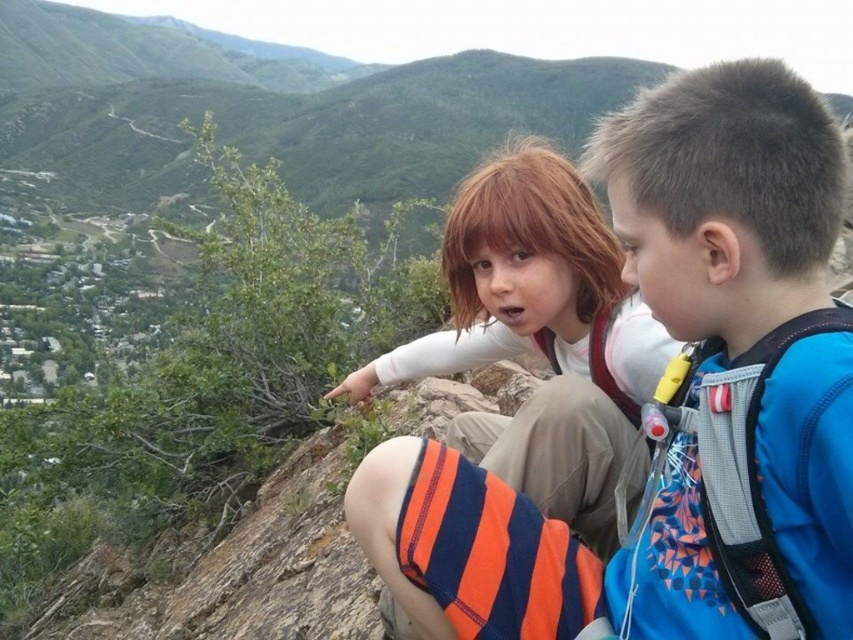
Who is more forward, (724, 634) or (579, 410)?

Point (724, 634) is in front.

At what (x,y) coordinates should I click in order to perform the action: click on blue fabric backpack at upper right. Please return your answer as a coordinate pair (x, y). The height and width of the screenshot is (640, 853). Looking at the image, I should click on (672, 406).